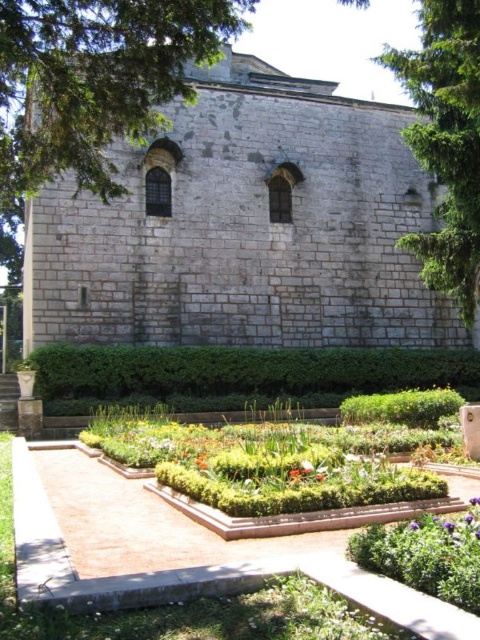
Who is taller, white stone chapel at center or green leafy hedge at center?

Standing taller between the two is white stone chapel at center.

Can you confirm if white stone chapel at center is positioned below green leafy hedge at center?

Actually, white stone chapel at center is above green leafy hedge at center.

Who is more distant from viewer, (274, 92) or (100, 380)?

Point (274, 92)

Locate an element on the screen. This screenshot has height=640, width=480. white stone chapel at center is located at coordinates (244, 227).

Who is lower down, white stone chapel at center or green leafy tree at upper right?

white stone chapel at center

Image resolution: width=480 pixels, height=640 pixels. Describe the element at coordinates (244, 227) in the screenshot. I see `white stone chapel at center` at that location.

Where is `white stone chapel at center`? The image size is (480, 640). white stone chapel at center is located at coordinates (244, 227).

Which of these two, green leafy hedge at center or green leafy tree at upper right, stands shorter?

With less height is green leafy hedge at center.

Is green leafy hedge at center smaller than green leafy tree at upper right?

Yes.

The height and width of the screenshot is (640, 480). Describe the element at coordinates (240, 374) in the screenshot. I see `green leafy hedge at center` at that location.

Image resolution: width=480 pixels, height=640 pixels. I want to click on green leafy hedge at center, so click(240, 374).